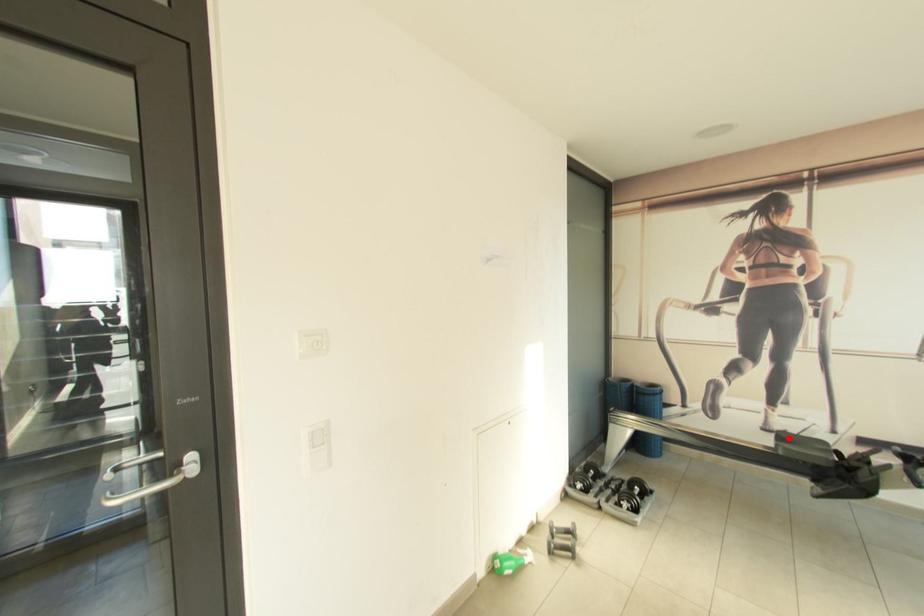
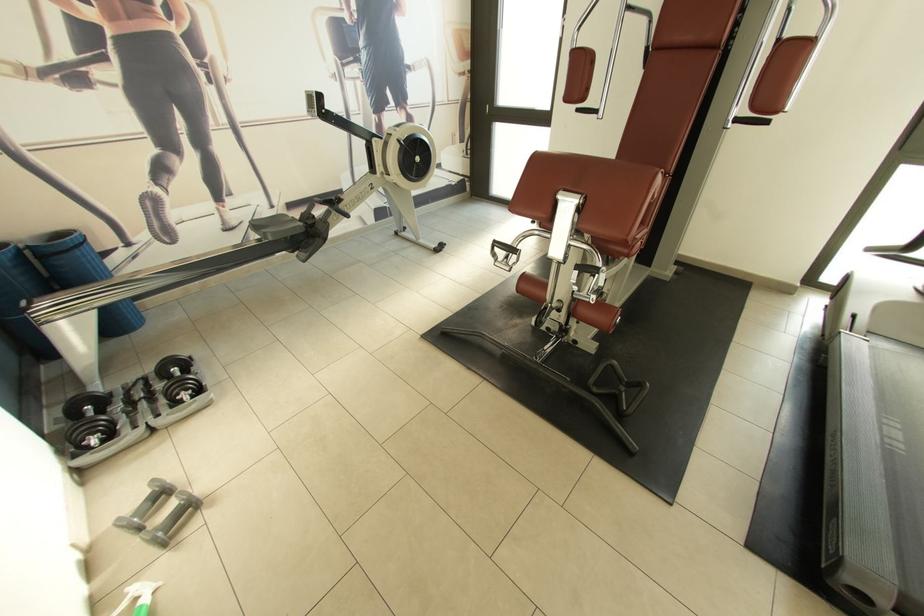
In the second image, find the point that corresponds to the highlighted location in the first image.

(262, 227)